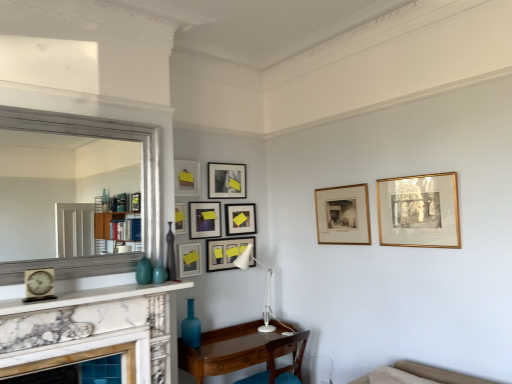
What do you see at coordinates (226, 181) in the screenshot? Image resolution: width=512 pixels, height=384 pixels. I see `matte black picture frame at upper center, the fifth picture frame when ordered from left to right` at bounding box center [226, 181].

Where is `matte black picture frame at upper center, the 5th picture frame positioned from the right`? matte black picture frame at upper center, the 5th picture frame positioned from the right is located at coordinates (226, 181).

In order to click on brown wooden table at lower center in this screenshot , I will do `click(227, 350)`.

Measure the distance between point (252, 211) and camera.

Point (252, 211) and camera are 3.96 meters apart.

Measure the distance between gold framed print at upper right, the 9th picture frame viewed from the left, and camera.

8.81 feet.

What do you see at coordinates (419, 211) in the screenshot?
I see `gold framed print at upper right, the 9th picture frame viewed from the left` at bounding box center [419, 211].

Where is `white matte desk lamp at center`? white matte desk lamp at center is located at coordinates (267, 306).

I want to click on matte black picture frame at upper center, the fifth picture frame when ordered from left to right, so click(226, 181).

Could you measure the distance between white marble mantle at lower left and matte black picture frame at upper center, the third picture frame when ordered from right to left?

1.22 meters.

Identify the location of mantle that appears in front of the matte black picture frame at upper center, the seventh picture frame viewed from the left. Image resolution: width=512 pixels, height=384 pixels. point(90,296).

Considering the sizes of white marble mantle at lower left and matte black picture frame at upper center, the seventh picture frame viewed from the left, in the image, is white marble mantle at lower left bigger or smaller than matte black picture frame at upper center, the seventh picture frame viewed from the left,?

Considering their sizes, white marble mantle at lower left takes up more space than matte black picture frame at upper center, the seventh picture frame viewed from the left.

Which object is further away from the camera taking this photo, white marble mantle at lower left or matte black picture frame at upper center, the third picture frame when ordered from right to left?

Positioned behind is matte black picture frame at upper center, the third picture frame when ordered from right to left.

Considering the positions of points (195, 346) and (365, 188), is point (195, 346) closer to camera compared to point (365, 188)?

Yes, it is.

From the image's perspective, who appears lower, blue glass vase at lower center, the 1th vase positioned from the back, or wooden picture frame at center, arranged as the 2th picture frame when viewed from the right?

blue glass vase at lower center, the 1th vase positioned from the back, appears lower in the image.

Does blue glass vase at lower center, the 1th vase positioned from the back, lie behind wooden picture frame at center, acting as the eighth picture frame starting from the left?

No, blue glass vase at lower center, the 1th vase positioned from the back, is closer to the camera.

Consider the image. Can you confirm if blue glass vase at lower center, arranged as the 2th vase when viewed from the front, is smaller than wooden picture frame at center, arranged as the 2th picture frame when viewed from the right?

Yes.

Is the position of brown wooden table at lower center less distant than that of matte black picture frame at upper center, the fourth picture frame in the left-to-right sequence?

Yes, brown wooden table at lower center is closer to the viewer.

How many degrees apart are the facing directions of brown wooden table at lower center and matte black picture frame at upper center, the fourth picture frame in the left-to-right sequence?

The facing directions of brown wooden table at lower center and matte black picture frame at upper center, the fourth picture frame in the left-to-right sequence, are 0.0978 degrees apart.

Is point (213, 375) less distant than point (216, 233)?

Yes, it is.

Locate an element on the screen. the 9th picture frame counting from the right side of the marble fireplace at lower left is located at coordinates (419, 211).

Which object is further away from the camera, gold framed print at upper right, the 9th picture frame viewed from the left, or marble fireplace at lower left?

Positioned behind is gold framed print at upper right, the 9th picture frame viewed from the left.

Is gold framed print at upper right, which appears as the first picture frame when viewed from the right, next to marble fireplace at lower left and touching it?

No, gold framed print at upper right, which appears as the first picture frame when viewed from the right, is not with marble fireplace at lower left.

Which object is positioned more to the left, gold framed print at upper right, which appears as the first picture frame when viewed from the right, or marble fireplace at lower left?

From the viewer's perspective, marble fireplace at lower left appears more on the left side.

Can you confirm if silver metallic mirror at left is wider than brown wooden chair at lower center?

No.

Where is `chair behind the silver metallic mirror at left`? This screenshot has height=384, width=512. chair behind the silver metallic mirror at left is located at coordinates (283, 367).

Based on the photo, is silver metallic mirror at left with brown wooden chair at lower center?

No, silver metallic mirror at left is not making contact with brown wooden chair at lower center.

Does point (143, 152) lie in front of point (291, 365)?

That is True.

Who is shorter, silver metallic mirror at left or white wall at center?

silver metallic mirror at left is shorter.

How distant is silver metallic mirror at left from white wall at center?

silver metallic mirror at left is 1.66 meters away from white wall at center.

Is silver metallic mirror at left looking in the opposite direction of white wall at center?

silver metallic mirror at left does not have its back to white wall at center.

Consider the image. Does silver metallic mirror at left have a larger size compared to white wall at center?

Actually, silver metallic mirror at left might be smaller than white wall at center.

Is matte gold picture frame at center, arranged as the seventh picture frame when viewed from the right, inside the boundaries of gold framed print at upper right, the 9th picture frame viewed from the left, or outside?

matte gold picture frame at center, arranged as the seventh picture frame when viewed from the right, is not inside gold framed print at upper right, the 9th picture frame viewed from the left, it's outside.

Is matte gold picture frame at center, the 3th picture frame viewed from the left, next to gold framed print at upper right, the 9th picture frame viewed from the left?

There is a gap between matte gold picture frame at center, the 3th picture frame viewed from the left, and gold framed print at upper right, the 9th picture frame viewed from the left.

Does point (190, 268) come in front of point (396, 180)?

That is False.

From a real-world perspective, which is physically above, matte gold picture frame at center, arranged as the seventh picture frame when viewed from the right, or gold framed print at upper right, the 9th picture frame viewed from the left?

gold framed print at upper right, the 9th picture frame viewed from the left.

This screenshot has height=384, width=512. Find the location of `the 3rd picture frame above the white marble mantle at lower left (from a real-world perspective)`. the 3rd picture frame above the white marble mantle at lower left (from a real-world perspective) is located at coordinates (240, 219).

You are a GUI agent. You are given a task and a screenshot of the screen. Output one action in this format:
    pyautogui.click(x=<x>, y=<y>)
    Task: Click on the 1st vase to the left when counting from the wooden picture frame at center, arranged as the 2th picture frame when viewed from the right
    
    Given the screenshot: What is the action you would take?
    pyautogui.click(x=191, y=327)

Which object lies nearer to the anchor point white marble mantle at lower left, white wall at center or matte ceramic vase at center, arranged as the first turquoise when viewed from the right?

Based on the image, matte ceramic vase at center, arranged as the first turquoise when viewed from the right, appears to be nearer to white marble mantle at lower left.

Looking at the image, which one is located closer to gold framed print at upper right, which appears as the first picture frame when viewed from the right, matte ceramic vase at center, which ranks as the 2th turquoise in left-to-right order, or matte gold picture frame at upper center, placed as the 8th picture frame when sorted from right to left?

Among the two, matte gold picture frame at upper center, placed as the 8th picture frame when sorted from right to left, is located nearer to gold framed print at upper right, which appears as the first picture frame when viewed from the right.

Looking at the image, which one is located closer to matte black picture frame at center, the 6th picture frame when ordered from left to right, matte black picture frame at upper center, the seventh picture frame viewed from the left, or wooden picture frame at center, arranged as the 2th picture frame when viewed from the right?

matte black picture frame at upper center, the seventh picture frame viewed from the left, is closer to matte black picture frame at center, the 6th picture frame when ordered from left to right.

Which object lies nearer to the anchor point wooden picture frame at center, arranged as the 2th picture frame when viewed from the right, gold framed print at upper right, the 9th picture frame viewed from the left, or brown wooden table at lower center?

Based on the image, gold framed print at upper right, the 9th picture frame viewed from the left, appears to be nearer to wooden picture frame at center, arranged as the 2th picture frame when viewed from the right.

When comparing their distances from matte blue glass vase at center, arranged as the 2th vase when viewed from the back, does matte silver clock at left or gold framed print at upper right, which appears as the first picture frame when viewed from the right, seem further?

Among the two, gold framed print at upper right, which appears as the first picture frame when viewed from the right, is located further to matte blue glass vase at center, arranged as the 2th vase when viewed from the back.

In the scene shown: When comparing their distances from matte black picture frame at upper center, the third picture frame when ordered from right to left, does matte ceramic vase at center, arranged as the first turquoise when viewed from the right, or gold framed print at upper right, which appears as the first picture frame when viewed from the right, seem closer?

The object closer to matte black picture frame at upper center, the third picture frame when ordered from right to left, is matte ceramic vase at center, arranged as the first turquoise when viewed from the right.

Considering their positions, is matte blue glass vase at center, which ranks as the 1th vase in top-to-bottom order, positioned further to matte black picture frame at upper center, the fourth picture frame in the left-to-right sequence, than matte ceramic vase at center, which ranks as the 2th turquoise in left-to-right order?

matte ceramic vase at center, which ranks as the 2th turquoise in left-to-right order, lies further to matte black picture frame at upper center, the fourth picture frame in the left-to-right sequence, than the other object.

Looking at the image, which one is located closer to matte black picture frame at upper center, the third picture frame when ordered from right to left, matte silver clock at left or wooden picture frame at center, arranged as the 2th picture frame when viewed from the right?

Among the two, wooden picture frame at center, arranged as the 2th picture frame when viewed from the right, is located nearer to matte black picture frame at upper center, the third picture frame when ordered from right to left.

Identify the location of vase that lies between matte black picture frame at upper center, the fifth picture frame when ordered from left to right, and white matte desk lamp at center from top to bottom. Image resolution: width=512 pixels, height=384 pixels. (170, 255).

Locate an element on the screen. chair positioned between white marble mantle at lower left and matte black picture frame at upper center, the seventh picture frame viewed from the left, from near to far is located at coordinates (x=283, y=367).

The width and height of the screenshot is (512, 384). I want to click on chair located between blue glass vase at lower center, which appears as the first vase when ordered from the bottom, and white wall at center in the left-right direction, so click(x=283, y=367).

Where is `clock between white marble mantle at lower left and matte black picture frame at upper center, the seventh picture frame viewed from the left, from front to back`? The image size is (512, 384). clock between white marble mantle at lower left and matte black picture frame at upper center, the seventh picture frame viewed from the left, from front to back is located at coordinates (39, 285).